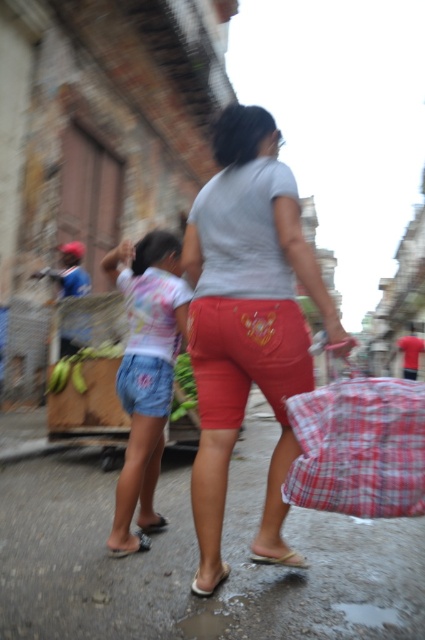
Is matte gray shirt at center shorter than white rubber sandal at lower center?

No.

Can you confirm if matte gray shirt at center is thinner than white rubber sandal at lower center?

No, matte gray shirt at center is not thinner than white rubber sandal at lower center.

The width and height of the screenshot is (425, 640). Identify the location of matte gray shirt at center. (246, 317).

Is the position of denim shorts at left more distant than that of brown leather sandal at lower center?

Yes, denim shorts at left is further from the viewer.

Between denim shorts at left and brown leather sandal at lower center, which one has less height?

brown leather sandal at lower center is shorter.

Does point (144, 403) come in front of point (266, 560)?

No.

Find the location of a particular element. This screenshot has width=425, height=640. denim shorts at left is located at coordinates (146, 372).

Between denim shorts at left and white rubber sandal at lower center, which one is positioned higher?

Positioned higher is denim shorts at left.

Locate an element on the screen. The image size is (425, 640). denim shorts at left is located at coordinates (146, 372).

Find the location of a particular element. The height and width of the screenshot is (640, 425). denim shorts at left is located at coordinates (146, 372).